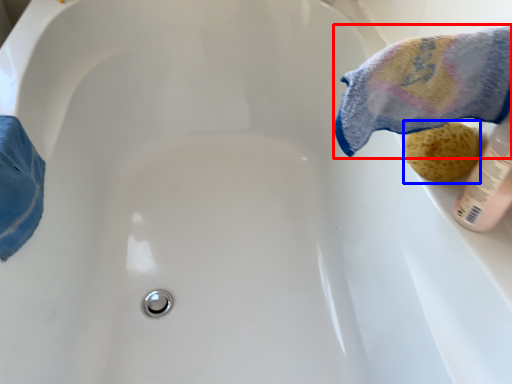
Question: Among these objects, which one is farthest to the camera, bath towel (highlighted by a red box) or stuff (highlighted by a blue box)?

Choices:
 (A) bath towel
 (B) stuff

Answer: (B)